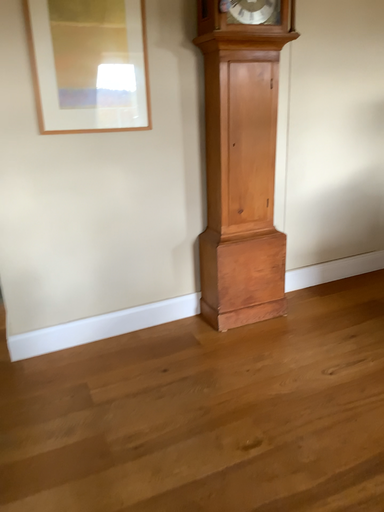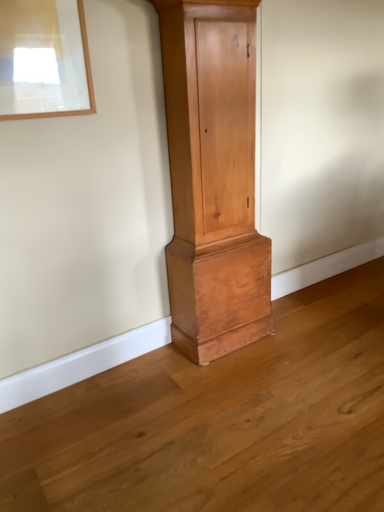
Question: How did the camera likely rotate when shooting the video?

Choices:
 (A) rotated left
 (B) rotated right

Answer: (B)